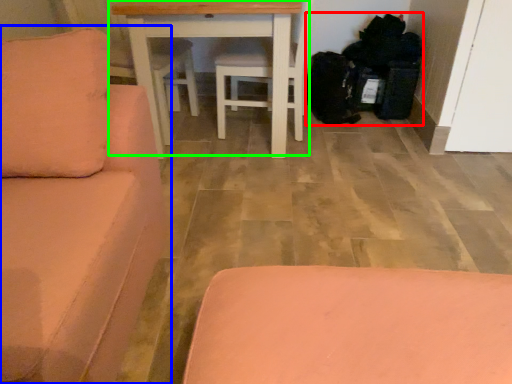
Question: Which is nearer to the garbage (highlighted by a red box)? studio couch (highlighted by a blue box) or table (highlighted by a green box).

Choices:
 (A) studio couch
 (B) table

Answer: (B)